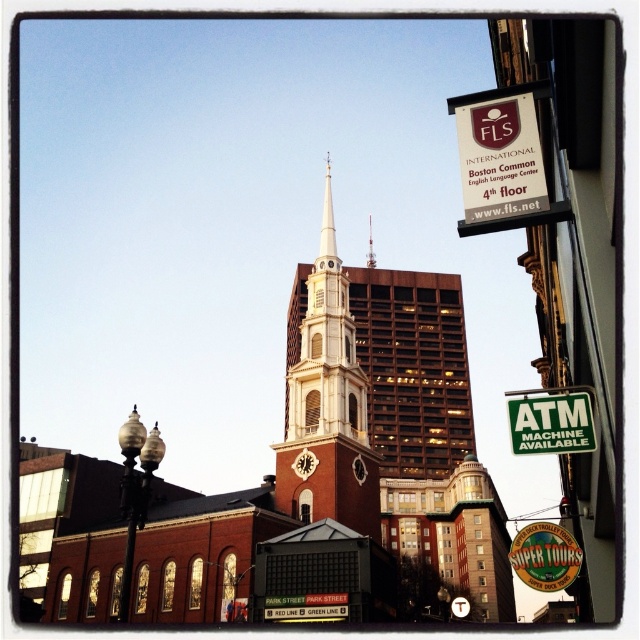
You are a tourist in Boston and see the brown brick church at center and the green plastic atm machine available sign at upper right. Which object is positioned higher in the image?

The green plastic atm machine available sign at upper right is positioned higher in the image than the brown brick church at center.